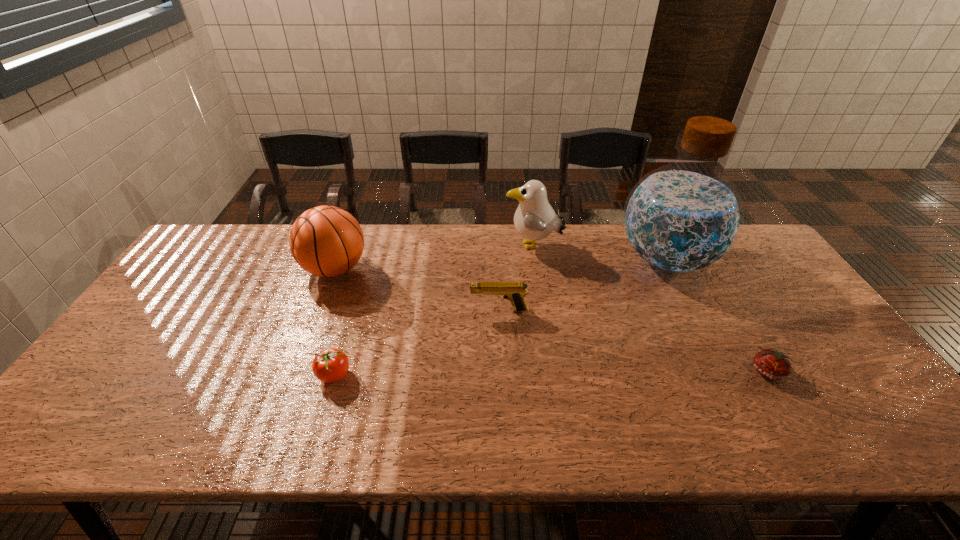
This screenshot has height=540, width=960. I want to click on vacant region located 0.170m on the beak of the gull, so click(453, 247).

Image resolution: width=960 pixels, height=540 pixels. Find the location of `vacant region located 0.200m on the beak of the gull`. vacant region located 0.200m on the beak of the gull is located at coordinates (444, 247).

You are a GUI agent. You are given a task and a screenshot of the screen. Output one action in this format:
    pyautogui.click(x=<x>, y=<y>)
    Task: Click on the vacant area located 0.290m on the beak of the gull
    
    Given the screenshot: What is the action you would take?
    pyautogui.click(x=418, y=247)

Image resolution: width=960 pixels, height=540 pixels. I want to click on free space located on the front of the basketball, so click(300, 362).

Locate an element on the screen. The width and height of the screenshot is (960, 540). free space located 0.230m at the barrel of the third shortest object is located at coordinates 389,310.

Identify the location of vacant space located 0.380m at the barrel of the third shortest object. The height and width of the screenshot is (540, 960). (336, 310).

Where is `free location located at the barrel of the third shortest object`? The height and width of the screenshot is (540, 960). free location located at the barrel of the third shortest object is located at coordinates (403, 310).

The height and width of the screenshot is (540, 960). In order to click on blank space located on the right of the taller tomato in this screenshot , I will do `click(511, 375)`.

Identify the location of free space located on the back of the shortest object. Image resolution: width=960 pixels, height=540 pixels. (739, 323).

What are the coordinates of `water jug located at the far edge` in the screenshot? It's located at (684, 217).